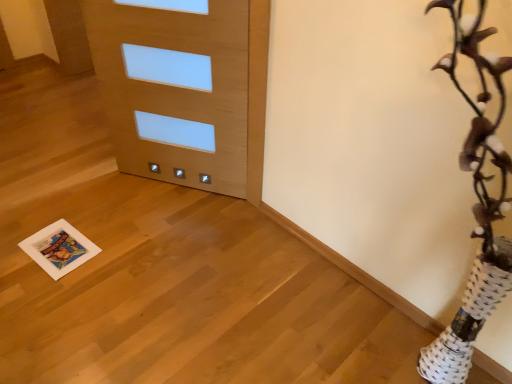
Question: Should I look upward or downward to see light wood door at center?

Choices:
 (A) down
 (B) up

Answer: (B)

Question: Is white paper print at lower left a part of light wood door at center?

Choices:
 (A) yes
 (B) no

Answer: (B)

Question: Does light wood door at center have a larger size compared to white paper print at lower left?

Choices:
 (A) no
 (B) yes

Answer: (B)

Question: Is light wood door at center next to white paper print at lower left and touching it?

Choices:
 (A) no
 (B) yes

Answer: (A)

Question: Does light wood door at center turn towards white paper print at lower left?

Choices:
 (A) yes
 (B) no

Answer: (B)

Question: Can you confirm if light wood door at center is smaller than white paper print at lower left?

Choices:
 (A) no
 (B) yes

Answer: (A)

Question: Is light wood door at center completely or partially outside of white paper print at lower left?

Choices:
 (A) yes
 (B) no

Answer: (A)

Question: Considering the relative sizes of white paper print at lower left and light wood door at center in the image provided, is white paper print at lower left smaller than light wood door at center?

Choices:
 (A) yes
 (B) no

Answer: (A)

Question: Are white paper print at lower left and light wood door at center located far from each other?

Choices:
 (A) no
 (B) yes

Answer: (A)

Question: Can you confirm if white paper print at lower left is wider than light wood door at center?

Choices:
 (A) no
 (B) yes

Answer: (B)

Question: From the image's perspective, is white paper print at lower left located above light wood door at center?

Choices:
 (A) no
 (B) yes

Answer: (A)

Question: From a real-world perspective, is white paper print at lower left physically above light wood door at center?

Choices:
 (A) no
 (B) yes

Answer: (A)

Question: Can you confirm if white paper print at lower left is bigger than light wood door at center?

Choices:
 (A) no
 (B) yes

Answer: (A)

Question: From the image's perspective, relative to white paper print at lower left, is light wood door at center above or below?

Choices:
 (A) above
 (B) below

Answer: (A)